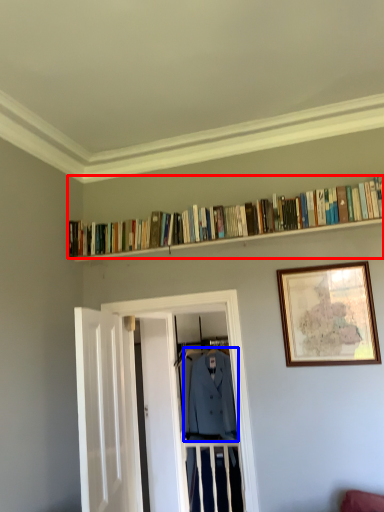
Question: Among these objects, which one is farthest to the camera, book (highlighted by a red box) or clothing (highlighted by a blue box)?

Choices:
 (A) book
 (B) clothing

Answer: (B)